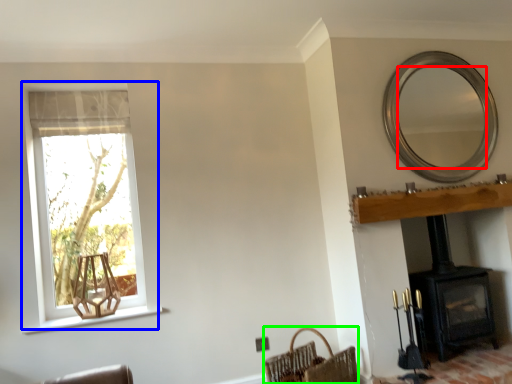
Question: Which object is positioned closest to mirror (highlighted by a red box)? Select from window (highlighted by a blue box) and basket (highlighted by a green box).

Choices:
 (A) window
 (B) basket

Answer: (B)